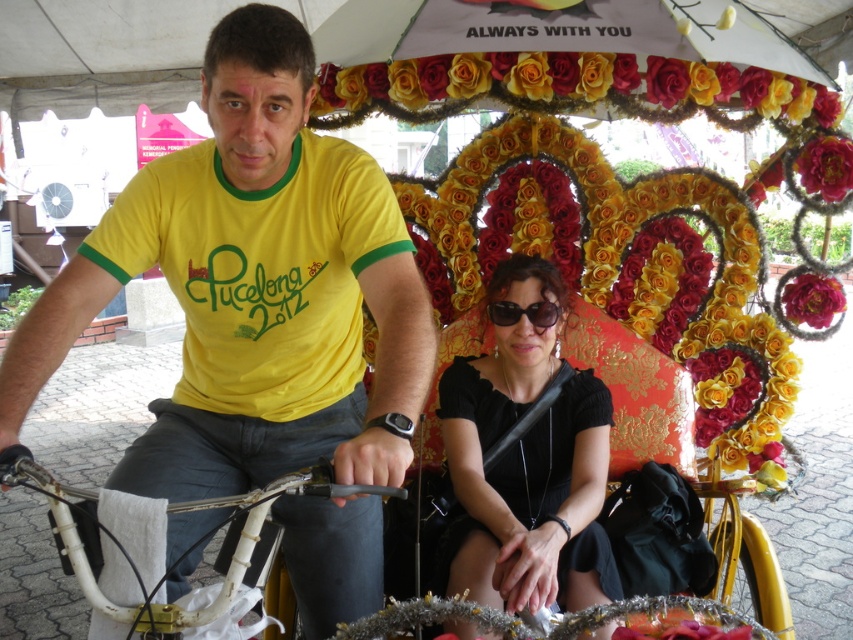
How distant is white matte bicycle handlebars at left from deep red silk flower at upper right?

A distance of 6.91 feet exists between white matte bicycle handlebars at left and deep red silk flower at upper right.

Is white matte bicycle handlebars at left to the left of deep red silk flower at upper right from the viewer's perspective?

Yes, white matte bicycle handlebars at left is to the left of deep red silk flower at upper right.

Between point (55, 502) and point (836, 172), which one is positioned in front?

Point (55, 502) is in front.

The height and width of the screenshot is (640, 853). Find the location of `white matte bicycle handlebars at left`. white matte bicycle handlebars at left is located at coordinates (167, 513).

Is deep red silk flower at center shorter than black plastic sunglasses at center?

No.

Measure the distance from deep red silk flower at center to black plastic sunglasses at center.

A distance of 38.54 inches exists between deep red silk flower at center and black plastic sunglasses at center.

Does point (817, 301) come behind point (508, 310)?

That is True.

At what (x,y) coordinates should I click in order to perform the action: click on deep red silk flower at center. Please return your answer as a coordinate pair (x, y). Image resolution: width=853 pixels, height=640 pixels. Looking at the image, I should click on (813, 300).

Is point (312, 296) in front of point (836, 200)?

Yes, it is in front of point (836, 200).

How distant is yellow matte shirt at center from deep red silk flower at upper right?

5.99 feet

Between point (86, 289) and point (822, 186), which one is positioned behind?

The point (822, 186) is behind.

Locate an element on the screen. yellow matte shirt at center is located at coordinates (252, 289).